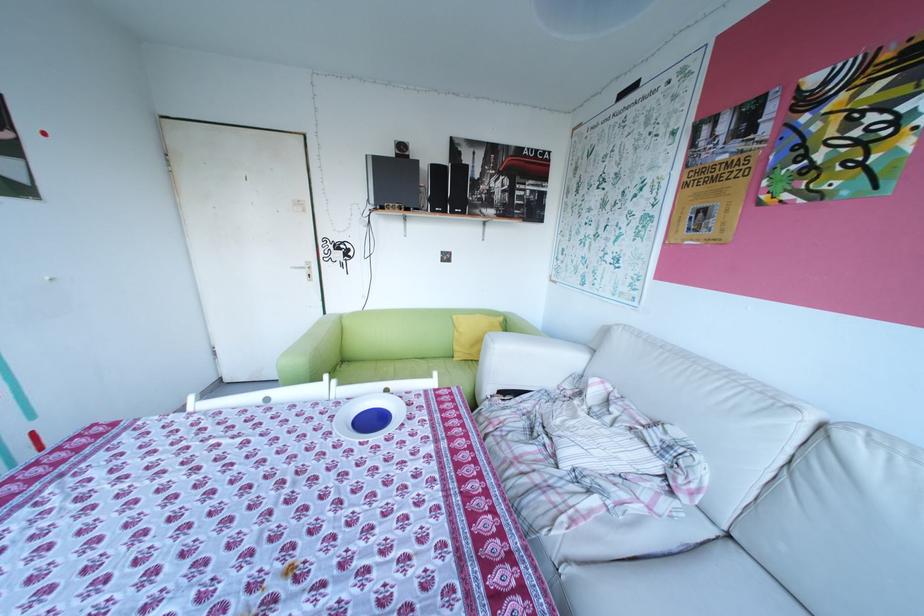
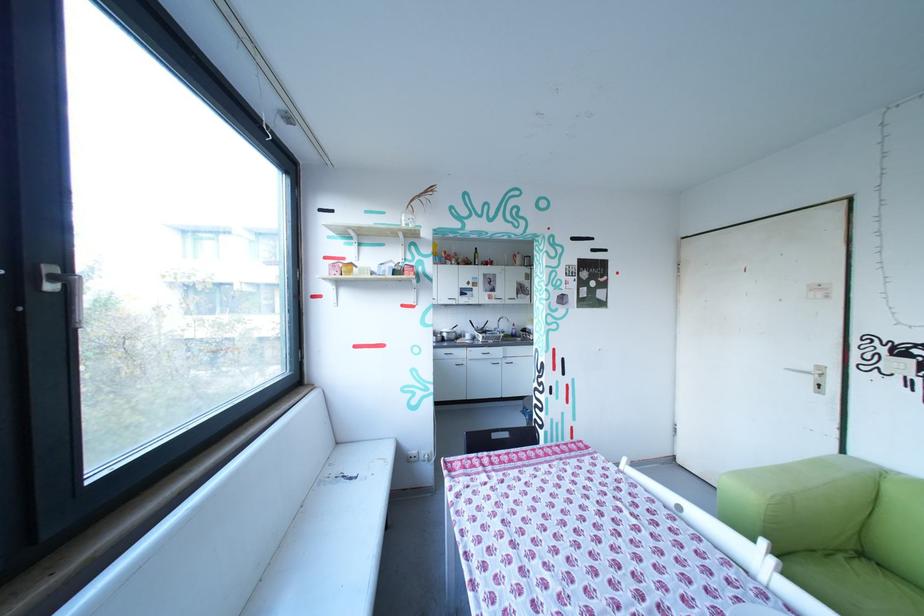
Question: How did the camera likely rotate?

Choices:
 (A) Left
 (B) Right
 (C) Up
 (D) Down

Answer: (A)